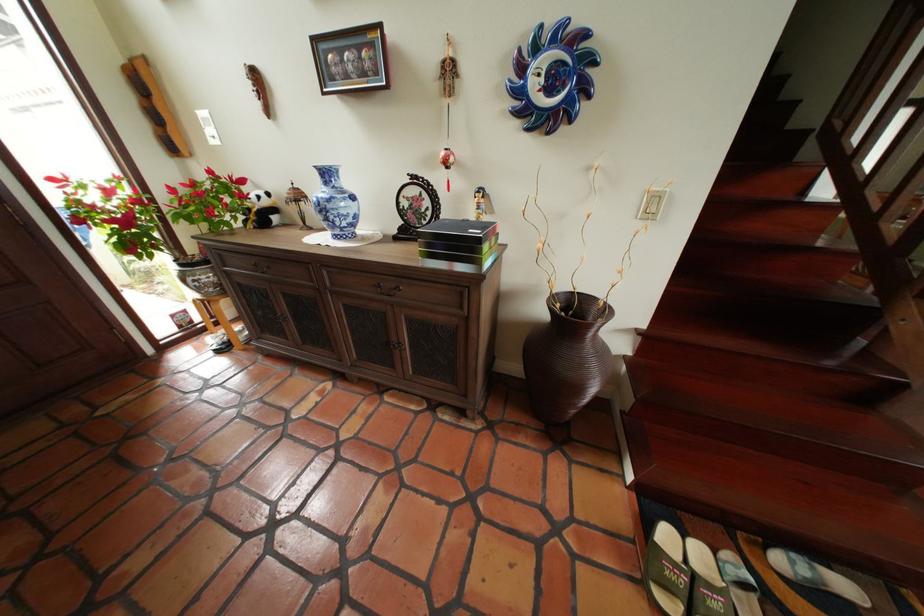
The location [566,357] corresponds to which object?

This point indicates the large brown vase.